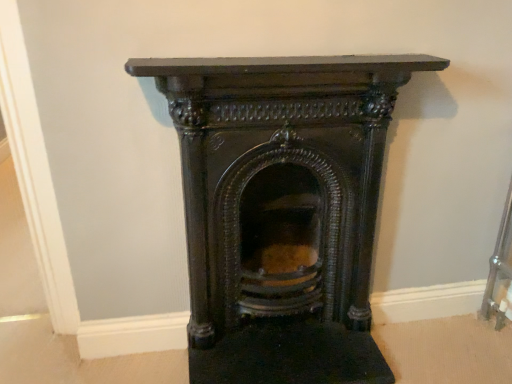
I want to click on vacant space underneath black cast iron fireplace at center (from a real-world perspective), so click(280, 328).